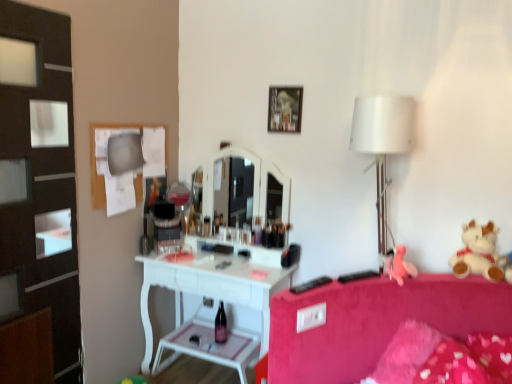
At what (x,y) coordinates should I click in order to perform the action: click on vacant space positioned to the left of matte glass bottle at center. Please return your answer as a coordinate pair (x, y). The image size is (512, 384). Looking at the image, I should click on (191, 342).